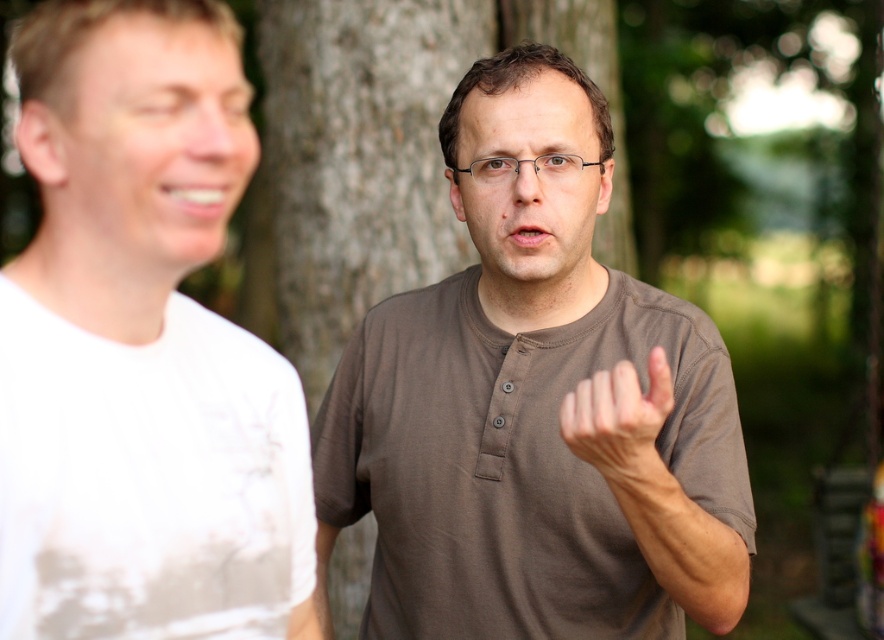
Between white matte t-shirt at left and matte brown hand at center, which one appears on the left side from the viewer's perspective?

white matte t-shirt at left

Who is more forward, (81, 300) or (649, 365)?

Point (81, 300)

Identify the location of white matte t-shirt at left. (133, 170).

Which of these two, brown cotton shirt at center or white matte t-shirt at left, stands shorter?

With less height is white matte t-shirt at left.

At what (x,y) coordinates should I click in order to perform the action: click on brown cotton shirt at center. Please return your answer as a coordinate pair (x, y). Looking at the image, I should click on (536, 404).

Find the location of a particular element. brown cotton shirt at center is located at coordinates (536, 404).

Which is in front, point (652, 298) or point (637, 464)?

Point (637, 464) is in front.

Is brown cotton shirt at center thinner than matte brown hand at center?

No, brown cotton shirt at center is not thinner than matte brown hand at center.

Is point (479, 368) in front of point (604, 426)?

No, it is not.

Locate an element on the screen. brown cotton shirt at center is located at coordinates (536, 404).